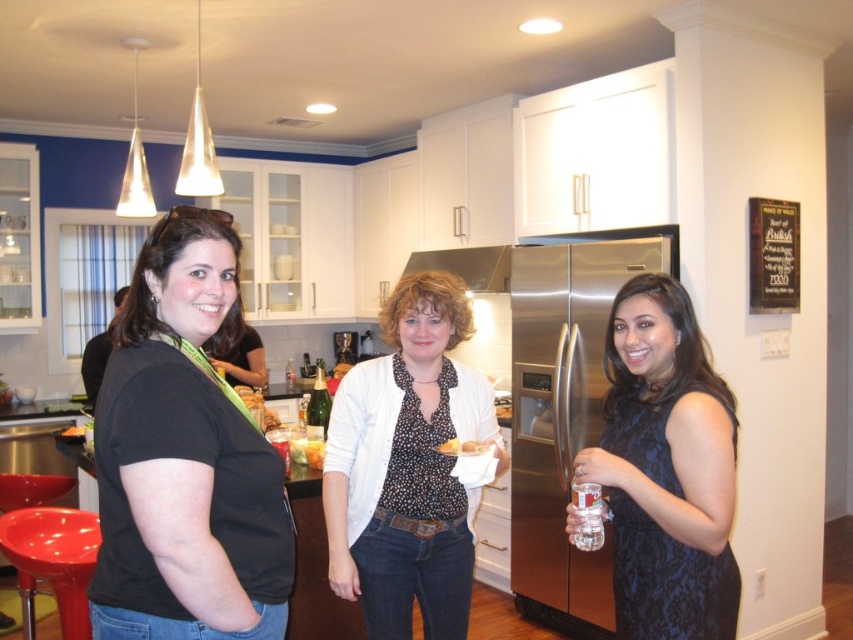
You are organizing a kitchen pantry and need to place the clear glass bottle at right and the green glass bottle at center on a shelf. According to their positions in the image, which bottle should you place on the right side of the shelf?

The clear glass bottle at right should be placed on the right side of the shelf because it is positioned to the right of the green glass bottle at center in the image.

Based on the photo, you are a delivery person who just arrived at the kitchen. You need to place a package on the clear glass bottle at right. The package is 1.5 meters long. Can you safely place it there without moving closer than 1.5 meters from the bottle?

The clear glass bottle at right is 1.67 meters away from the camera. Since the package is 1.5 meters long, placing it at that distance would require the package to extend beyond the bottle, but since you must stay at least 1.5 meters away, you can safely place the package as the distance allows it without needing to move closer than required.

You are a delivery person trying to place a package that is 1.2 meters long between the black matte shirt at left and the shiny plastic stool at lower left. Will the package fit in the space between them?

The distance between the black matte shirt at left and the shiny plastic stool at lower left is 1.17 meters. Since the package is 1.2 meters long, it will not fit in the space between them.